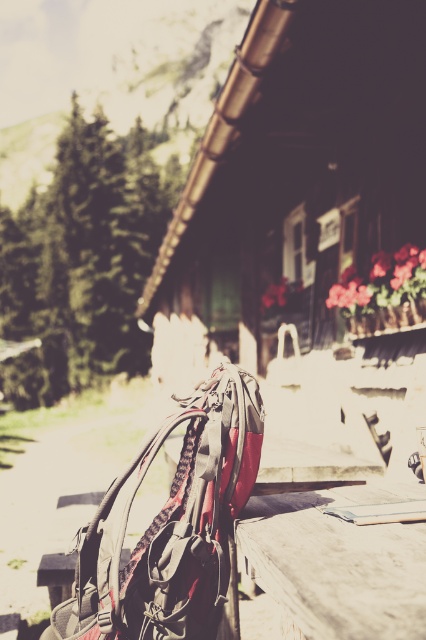
Does wooden cabin at center have a larger size compared to wooden table at center?

Yes.

From the picture: Which of these two, wooden cabin at center or wooden table at center, stands shorter?

Standing shorter between the two is wooden table at center.

Who is more forward, [385,60] or [385,557]?

Point [385,557] is in front.

Where is `wooden cabin at center`? The height and width of the screenshot is (640, 426). wooden cabin at center is located at coordinates (308, 221).

Is matte black backpack at center taller than wooden table at center?

Yes, matte black backpack at center is taller than wooden table at center.

Between matte black backpack at center and wooden table at center, which one has less height?

With less height is wooden table at center.

Is point (98, 518) positioned before point (414, 614)?

No, it is not.

Image resolution: width=426 pixels, height=640 pixels. Identify the location of matte black backpack at center. (x=172, y=525).

Is green textured pine at left further to camera compared to wooden table at center?

Yes, green textured pine at left is further from the viewer.

Who is more distant from viewer, (75, 384) or (324, 515)?

The point (75, 384) is more distant.

Identify the location of green textured pine at left. (83, 260).